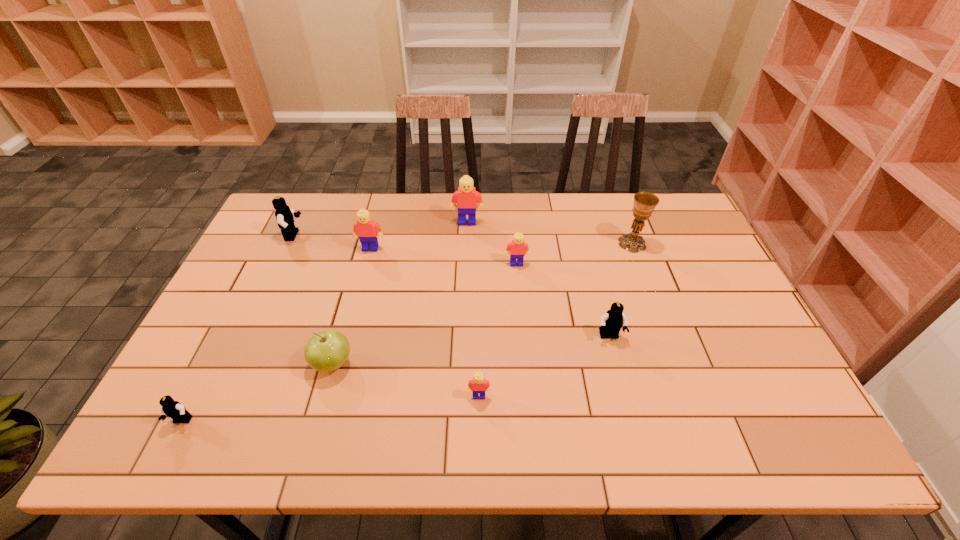
Identify the location of the eighth object from left to right. click(x=611, y=323).

Where is `the second farthest black Lego`? Image resolution: width=960 pixels, height=540 pixels. the second farthest black Lego is located at coordinates pos(611,323).

Where is `apple`? apple is located at coordinates (327, 350).

Where is `green apple`? This screenshot has height=540, width=960. green apple is located at coordinates (327, 350).

Identify the location of the eighth farthest object. (478, 384).

The image size is (960, 540). What are the coordinates of `the smallest yellow Lego` in the screenshot? It's located at (478, 384).

The height and width of the screenshot is (540, 960). Identify the location of the nearest black Lego. (173, 409).

Locate an element on the screen. The image size is (960, 540). the smallest black Lego is located at coordinates pyautogui.click(x=173, y=409).

Identify the location of free space located on the front-facing side of the farthest object. The width and height of the screenshot is (960, 540). (467, 244).

Locate an element on the screen. The image size is (960, 540). vacant position located on the left of the rightmost object is located at coordinates (588, 244).